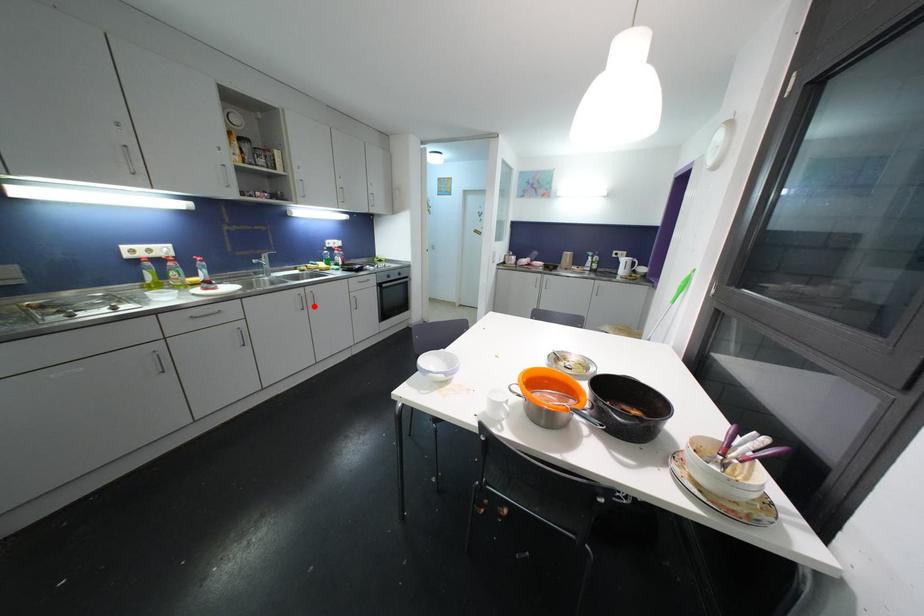
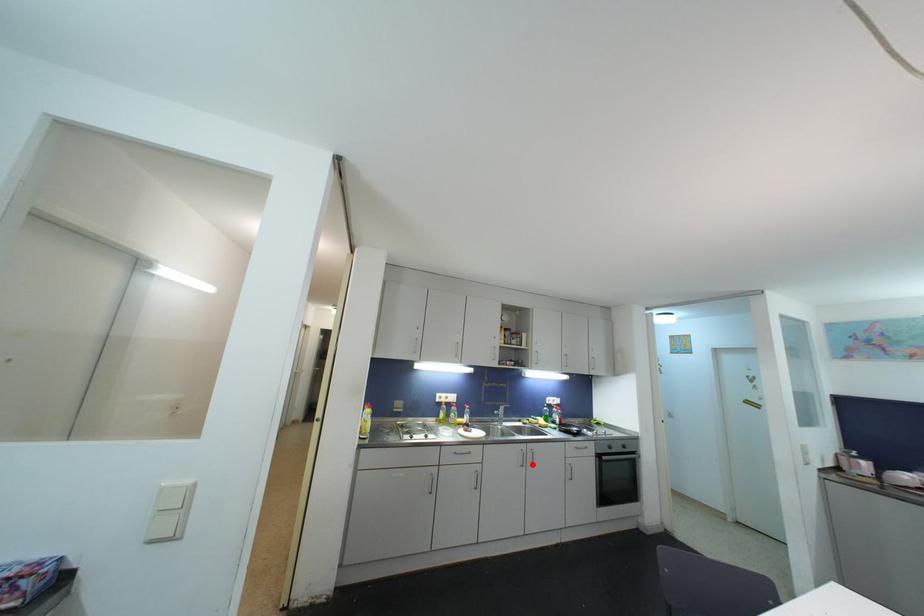
I am providing you with two images of the same scene from different viewpoints. A red point is marked on the first image and another point is marked on the second image. Is the red point in image1 aligned with the point shown in image2?

Yes